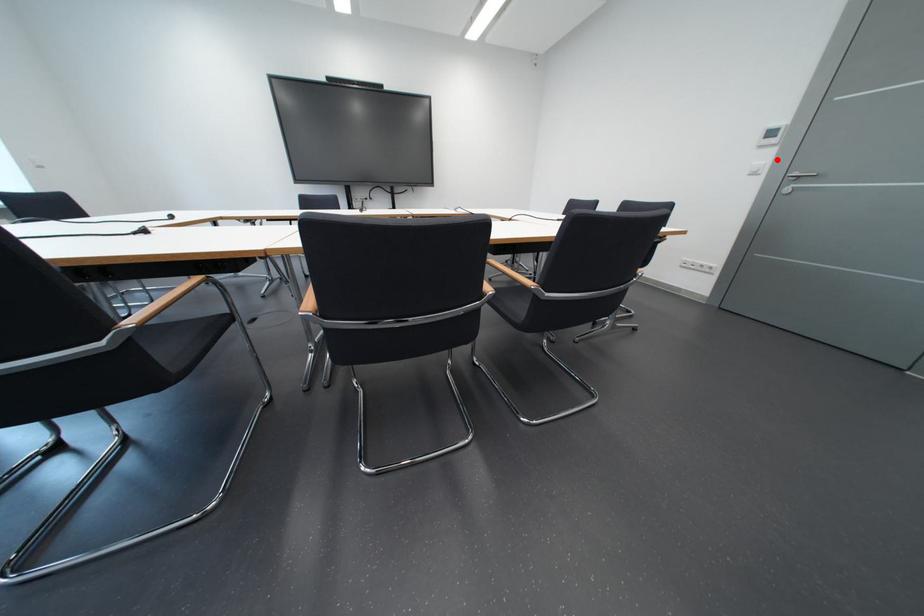
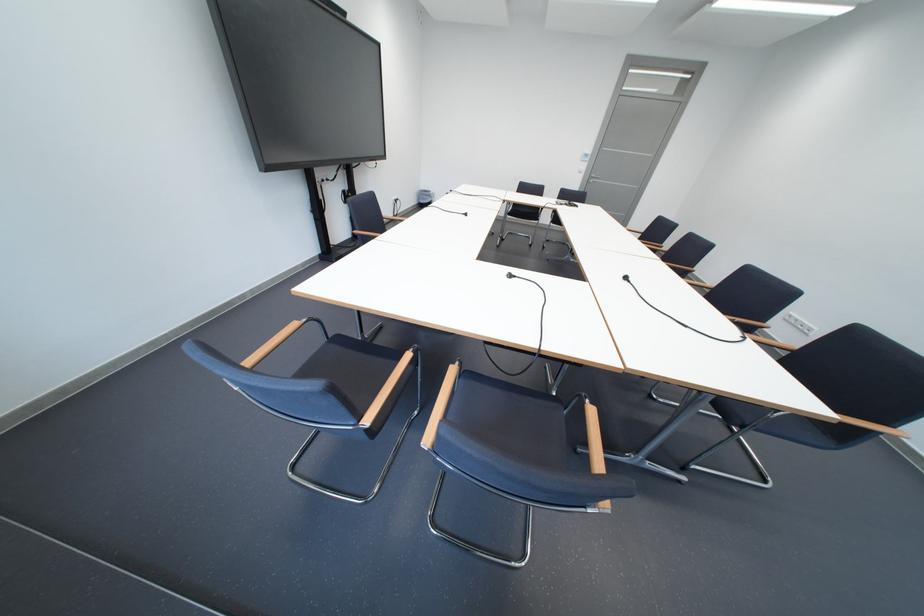
Question: A red point is marked in image1. In image2, is the corresponding 3D point closer to the camera or farther? Reply with the corresponding letter.

Choices:
 (A) The corresponding 3D point is closer.
 (B) The corresponding 3D point is farther.

Answer: (A)